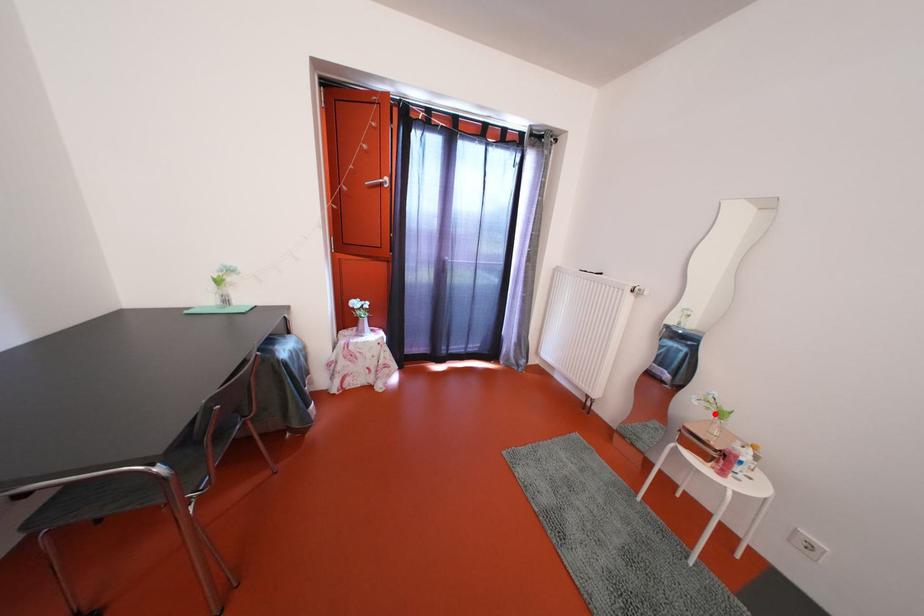
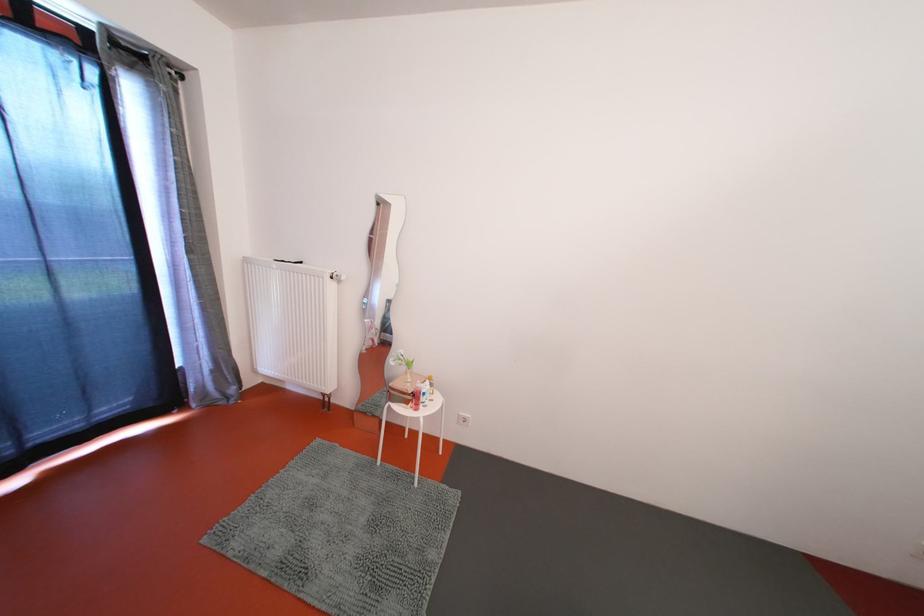
Question: I am providing you with two images of the same scene from different viewpoints. A red point is marked on the first image. At the location where the point appears in image 1, is it still visible in image 2?

Choices:
 (A) Yes
 (B) No

Answer: (A)